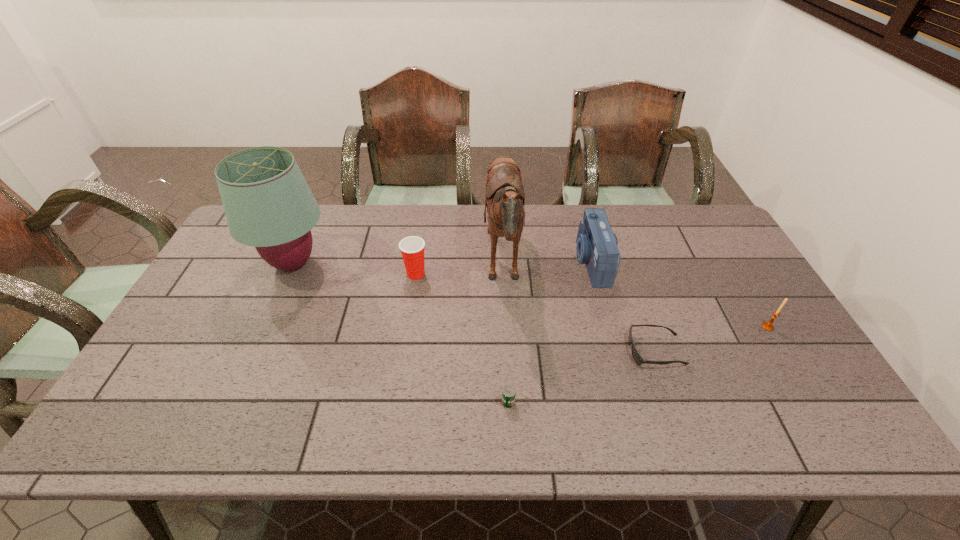
The image size is (960, 540). I want to click on unoccupied position between the beer can and the sixth object from right to left, so click(x=462, y=338).

Where is `free spot between the Dixie cup and the saddle`? free spot between the Dixie cup and the saddle is located at coordinates (460, 269).

You are a GUI agent. You are given a task and a screenshot of the screen. Output one action in this format:
    pyautogui.click(x=<x>, y=<y>)
    Task: Click on the unoccupied position between the shortest object and the camera
    
    Given the screenshot: What is the action you would take?
    click(623, 306)

You are a GUI agent. You are given a task and a screenshot of the screen. Output one action in this format:
    pyautogui.click(x=<x>, y=<y>)
    Task: Click on the free point between the lampshade and the sunglasses
    This screenshot has width=960, height=540.
    Given the screenshot: What is the action you would take?
    pyautogui.click(x=474, y=307)

What are the coordinates of `empty space that is in between the rightmost object and the sixth farthest object` in the screenshot? It's located at (711, 339).

Select which object appears as the closest to the fifth farthest object. Please provide its 2D coordinates. Your answer should be formatted as a tuple, i.e. [(x, y)], where the tuple contains the x and y coordinates of a point satisfying the conditions above.

[(639, 360)]

This screenshot has height=540, width=960. Identify the location of the fifth closest object to the saddle. (268, 204).

At what (x,y) coordinates should I click in order to perform the action: click on vacant space that satisfies the following two spatial constraints: 1. on the lens of the camera; 2. on the front side of the lampshade. Please return your answer as a coordinate pair (x, y). The width and height of the screenshot is (960, 540). Looking at the image, I should click on (591, 264).

What are the coordinates of `free region that satisfies the following two spatial constraints: 1. on the front-facing side of the sunglasses; 2. on the front side of the beer can` in the screenshot? It's located at (674, 402).

Where is `vacant space that satisfies the following two spatial constraints: 1. on the lens of the candle_holder; 2. on the left side of the camera`? The image size is (960, 540). vacant space that satisfies the following two spatial constraints: 1. on the lens of the candle_holder; 2. on the left side of the camera is located at coordinates (609, 327).